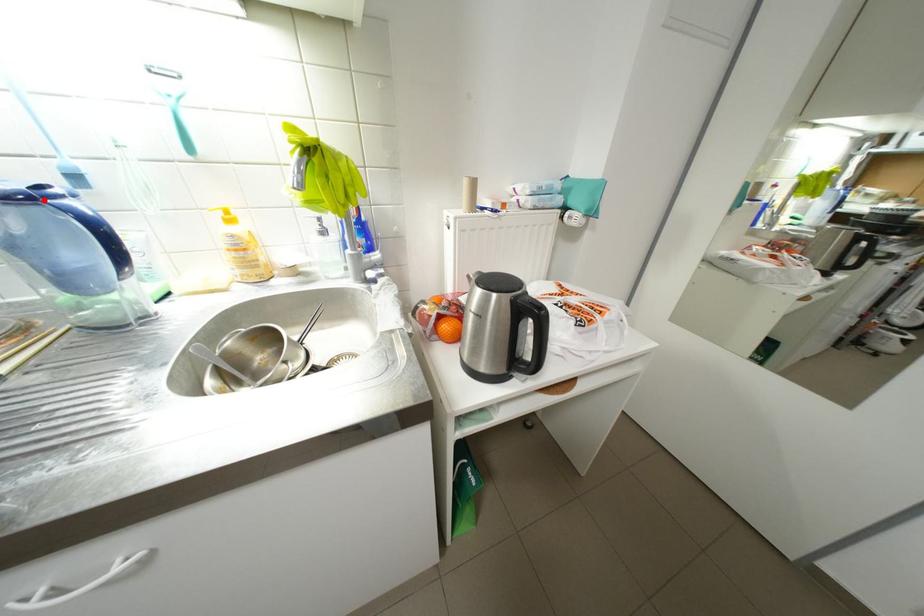
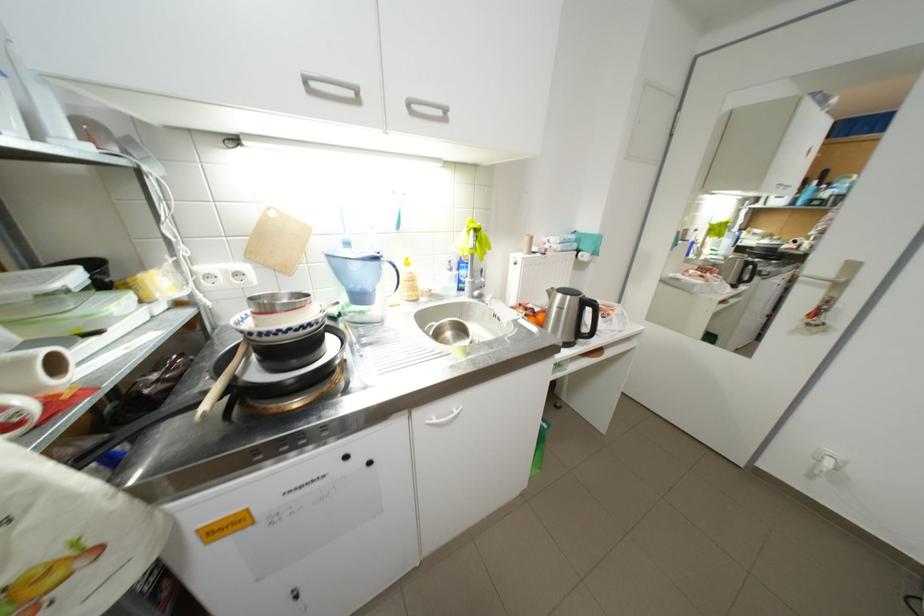
In the second image, find the point that corresponds to the highlighted location in the first image.

(387, 259)